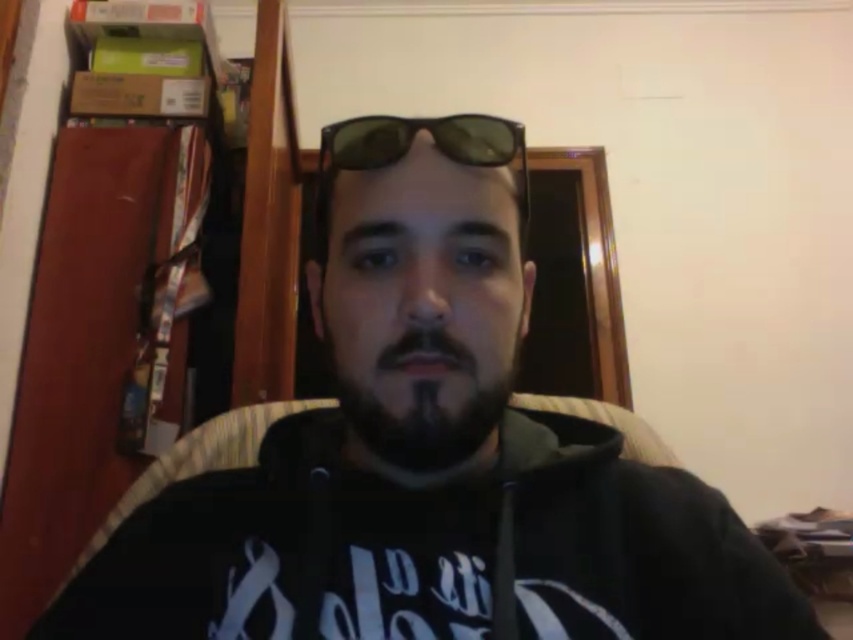
Based on the scene description, where is the dark brown beard at center in relation to the black matte sunglasses at center?

The dark brown beard at center is located below the black matte sunglasses at center.

Consider the image. You are a photographer taking a portrait of the person in the scene. You need to ensure that the dark brown beard at center and the black matte sunglasses at center are both clearly visible in the photo. Based on their sizes, which object should you focus on first to ensure sharpness?

The dark brown beard at center is shorter than the black matte sunglasses at center, so you should focus on the black matte sunglasses at center first since it is larger and requires more precise focus to capture details clearly.

You are a photographer trying to capture a closeup of the dark brown beard at center and the black matte sunglasses at center. Which object should you zoom in more on to ensure both are in focus?

The dark brown beard at center is smaller than the black matte sunglasses at center, so you should zoom in more on the dark brown beard at center to ensure both are in focus.